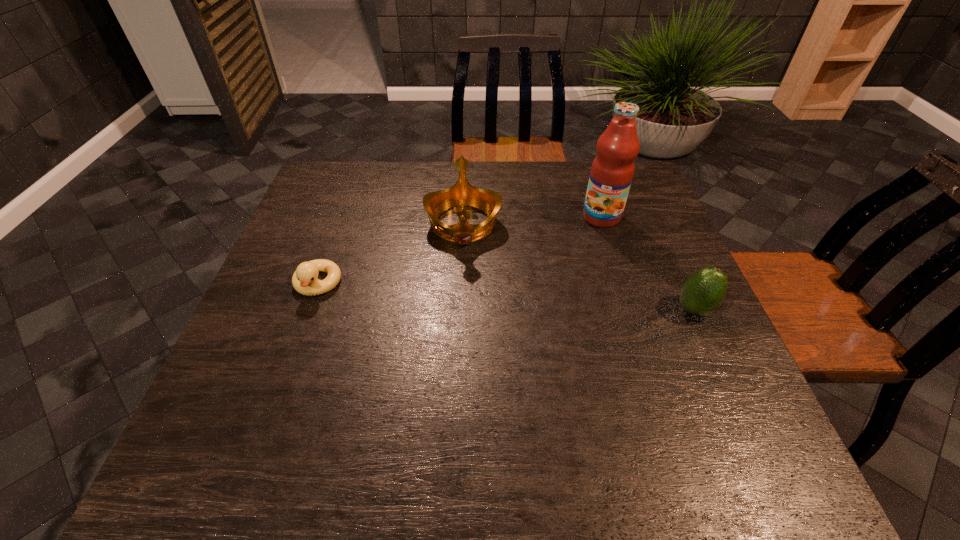
Find the location of a particular element. The width and height of the screenshot is (960, 540). vacant region located on the front label of the tallest object is located at coordinates (587, 242).

You are a GUI agent. You are given a task and a screenshot of the screen. Output one action in this format:
    pyautogui.click(x=<x>, y=<y>)
    Task: Click on the free location located at the front emblem of the third object from right to left
    This screenshot has height=540, width=960.
    Given the screenshot: What is the action you would take?
    pyautogui.click(x=465, y=319)

This screenshot has width=960, height=540. I want to click on free space located at the front emblem of the third object from right to left, so click(465, 377).

Locate an element on the screen. The image size is (960, 540). vacant region located at the front emblem of the third object from right to left is located at coordinates (465, 319).

You are a GUI agent. You are given a task and a screenshot of the screen. Output one action in this format:
    pyautogui.click(x=<x>, y=<y>)
    Task: Click on the fruit juice that is at the far edge
    This screenshot has width=960, height=540.
    Given the screenshot: What is the action you would take?
    [x=612, y=170]

Locate an element on the screen. This screenshot has height=540, width=960. tiara present at the far edge is located at coordinates (462, 194).

Where is `object at the left edge`? object at the left edge is located at coordinates (304, 280).

Where is `avocado positioned at the right edge`? avocado positioned at the right edge is located at coordinates (702, 293).

Identify the location of fruit juice that is at the right edge. (612, 170).

This screenshot has width=960, height=540. I want to click on object that is at the far right corner, so click(x=612, y=170).